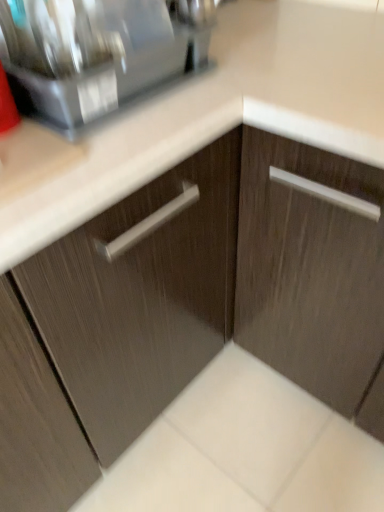
This screenshot has width=384, height=512. What do you see at coordinates (313, 272) in the screenshot?
I see `dark wood cabinet at center` at bounding box center [313, 272].

Identify the location of dark wood cabinet at center. (313, 272).

The image size is (384, 512). Find the location of `dark wood cabinet at center`. dark wood cabinet at center is located at coordinates (313, 272).